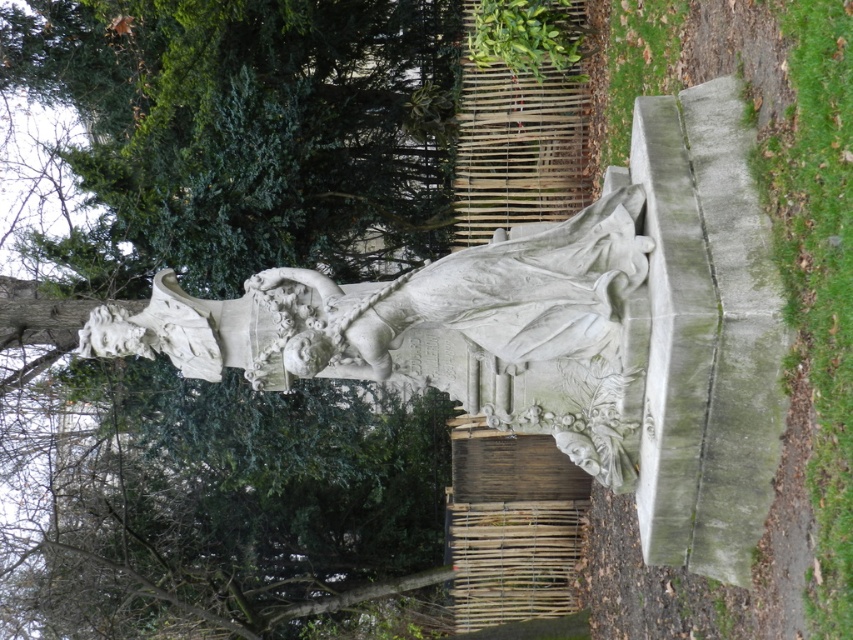
You are an art student observing the sculpture and the tree in the park. Which object has a greater width when comparing the green leafy tree at upper left and the white stone statue at center?

The white stone statue at center is wider than the green leafy tree at upper left.

You are a photographer planning to take a photo of the white stone statue at center. You want to ensure the green leafy tree at upper left does not block the statue in the shot. Based on their heights, can you position yourself so that the tree is below the statue in the frame?

The green leafy tree at upper left is shorter than the white stone statue at center. Therefore, positioning yourself at a lower angle would allow the tree to appear below the statue in the frame without blocking it.